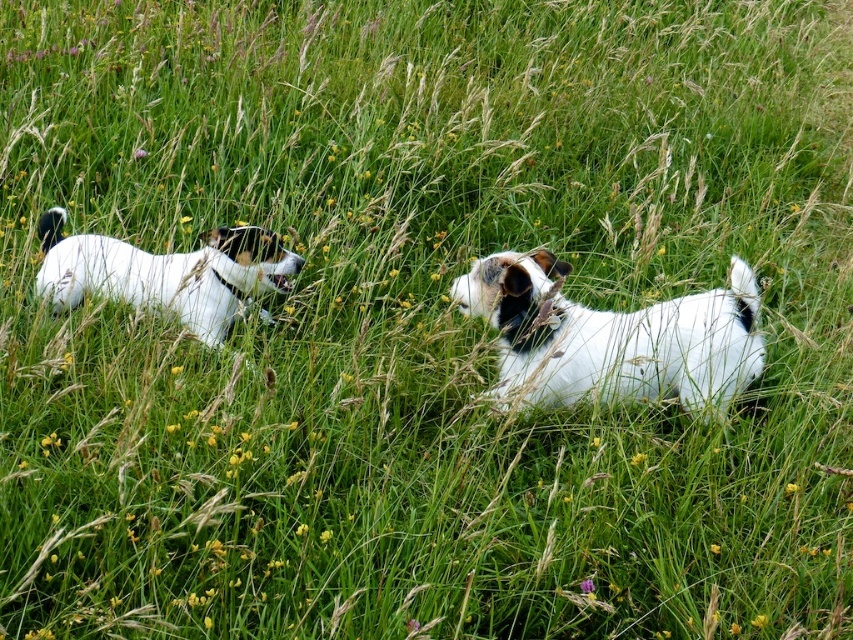
Question: Does white fur dog at center have a larger size compared to white fur dog at left?

Choices:
 (A) yes
 (B) no

Answer: (A)

Question: Which point is farther from the camera taking this photo?

Choices:
 (A) (253, 273)
 (B) (712, 323)

Answer: (A)

Question: Does white fur dog at center have a lesser width compared to white fur dog at left?

Choices:
 (A) yes
 (B) no

Answer: (B)

Question: Which of the following is the closest to the observer?

Choices:
 (A) white fur dog at left
 (B) white fur dog at center

Answer: (B)

Question: Where is white fur dog at center located in relation to white fur dog at left in the image?

Choices:
 (A) right
 (B) left

Answer: (A)